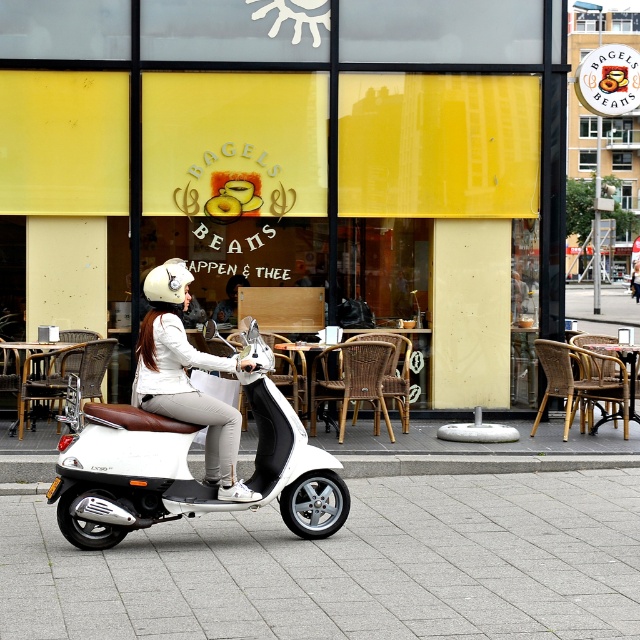
Who is taller, yellow matte glass at center or white matte scooter at center?

yellow matte glass at center is taller.

Who is positioned more to the left, yellow matte glass at center or white matte scooter at center?

From the viewer's perspective, yellow matte glass at center appears more on the left side.

This screenshot has width=640, height=640. What are the coordinates of `yellow matte glass at center` in the screenshot? It's located at (292, 168).

Between point (115, 493) and point (192, 406), which one is positioned in front?

Point (115, 493) is in front.

Can you confirm if white matte scooter at center is positioned above white matte helmet at upper left?

No, white matte scooter at center is not above white matte helmet at upper left.

Is point (166, 451) farther from viewer compared to point (193, 396)?

No, (166, 451) is closer to viewer.

Find the location of `white matte scooter at center`. white matte scooter at center is located at coordinates coord(186,467).

Between point (168, 256) and point (154, 291), which one is positioned in front?

Point (154, 291) is in front.

Which is behind, point (502, 248) or point (212, 403)?

The point (502, 248) is more distant.

Which is in front, point (349, 250) or point (204, 403)?

Point (204, 403) is in front.

Identify the location of yellow matte glass at center. The height and width of the screenshot is (640, 640). [x=292, y=168].